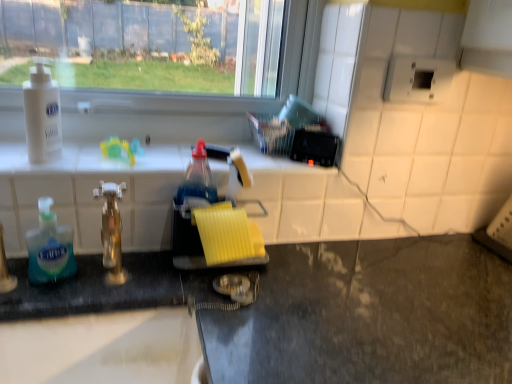
At what (x,y) coordinates should I click in order to perform the action: click on vacant area that lies between gold metallic faucet at center and translucent plastic soap dispenser at left, arranged as the 1th bottle when ordered from the bottom. Please return your answer as a coordinate pair (x, y). The image size is (512, 384). Looking at the image, I should click on (76, 286).